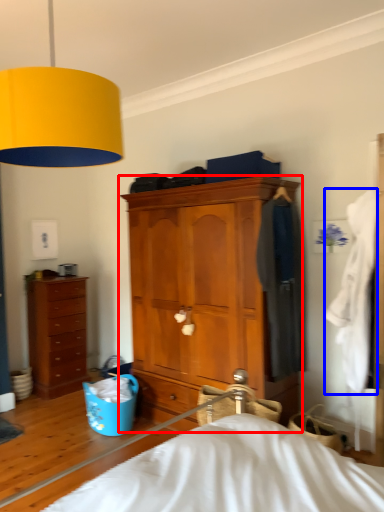
Question: Which point is closer to the camera, chest of drawers (highlighted by a red box) or clothing (highlighted by a blue box)?

Choices:
 (A) chest of drawers
 (B) clothing

Answer: (B)